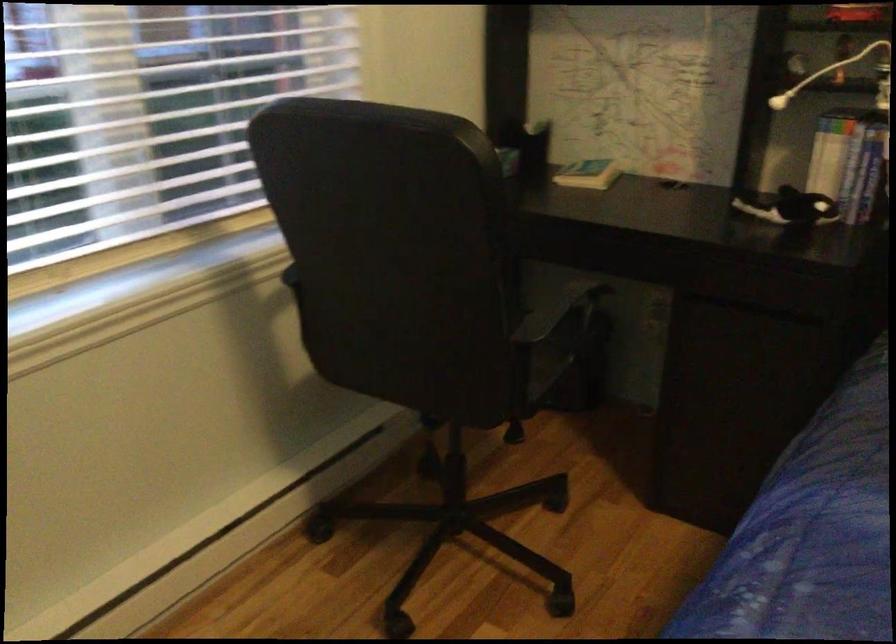
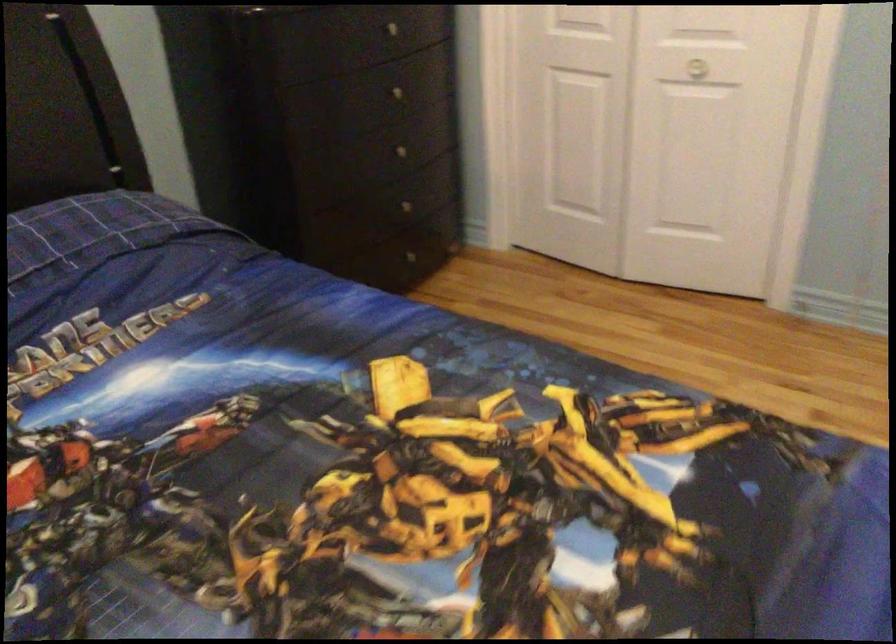
The images are taken continuously from a first-person perspective. In which direction is your viewpoint rotating?

The camera's rotation is toward right-down.